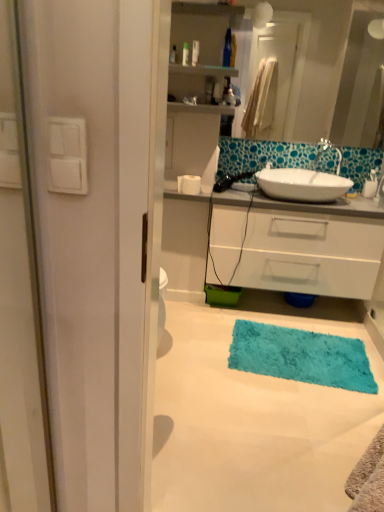
Question: Can you confirm if white matte toilet paper at center is thinner than white glossy sink at center?

Choices:
 (A) no
 (B) yes

Answer: (B)

Question: Can you confirm if white matte toilet paper at center is positioned to the left of white glossy sink at center?

Choices:
 (A) yes
 (B) no

Answer: (A)

Question: From the image's perspective, is white matte toilet paper at center located above white glossy sink at center?

Choices:
 (A) yes
 (B) no

Answer: (B)

Question: Is white matte toilet paper at center wider than white glossy sink at center?

Choices:
 (A) no
 (B) yes

Answer: (A)

Question: Is white glossy sink at center located within white matte toilet paper at center?

Choices:
 (A) no
 (B) yes

Answer: (A)

Question: From a real-world perspective, is white matte toilet paper at center positioned over white glossy sink at center based on gravity?

Choices:
 (A) yes
 (B) no

Answer: (B)

Question: Can you confirm if translucent plastic bottle at upper center is taller than turquoise shaggy rug at lower center?

Choices:
 (A) yes
 (B) no

Answer: (A)

Question: Is translucent plastic bottle at upper center turned away from turquoise shaggy rug at lower center?

Choices:
 (A) yes
 (B) no

Answer: (B)

Question: Are translucent plastic bottle at upper center and turquoise shaggy rug at lower center making contact?

Choices:
 (A) no
 (B) yes

Answer: (A)

Question: Does translucent plastic bottle at upper center lie in front of turquoise shaggy rug at lower center?

Choices:
 (A) no
 (B) yes

Answer: (A)

Question: From a real-world perspective, does translucent plastic bottle at upper center stand above turquoise shaggy rug at lower center?

Choices:
 (A) no
 (B) yes

Answer: (B)

Question: Is translucent plastic bottle at upper center oriented towards turquoise shaggy rug at lower center?

Choices:
 (A) yes
 (B) no

Answer: (B)

Question: From a real-world perspective, is turquoise shaggy rug at lower center physically below turquoise shaggy bath mat at lower center?

Choices:
 (A) yes
 (B) no

Answer: (A)